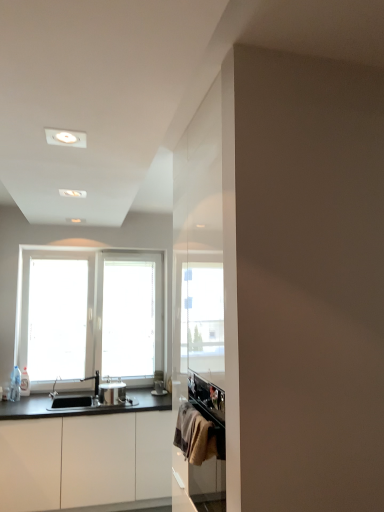
Question: From the image's perspective, is satin silver pot at center, positioned as the second appliance in right-to-left order, positioned above or below textured beige towel at lower right?

Choices:
 (A) below
 (B) above

Answer: (A)

Question: Is satin silver pot at center, positioned as the 1th appliance in left-to-right order, to the left or to the right of textured beige towel at lower right in the image?

Choices:
 (A) left
 (B) right

Answer: (A)

Question: Which object is the closest to the satin silver pot at center, which ranks as the 2th appliance in back-to-front order?

Choices:
 (A) textured beige towel at lower right
 (B) metallic silver toaster at center, marked as the first appliance in a right-to-left arrangement
 (C) white matte cabinet at lower left
 (D) clear glass bottle at left
 (E) satin nickel faucet at sink left

Answer: (E)

Question: Which object is positioned farthest from the white matte cabinet at lower left?

Choices:
 (A) satin silver pot at center, positioned as the 1th appliance in left-to-right order
 (B) textured beige towel at lower right
 (C) metallic silver toaster at center, the first appliance from the back
 (D) satin nickel faucet at sink left
 (E) clear glass bottle at left

Answer: (B)